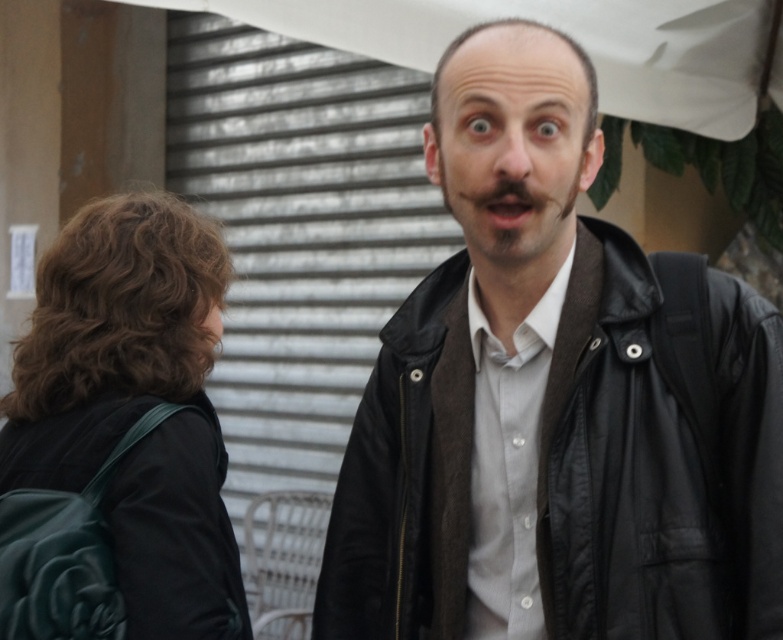
Measure the distance between dark brown hair at left and camera.

The distance of dark brown hair at left from camera is 2.20 meters.

Which of these two, dark brown hair at left or brown fuzzy beard at center, stands taller?

With more height is dark brown hair at left.

Locate an element on the screen. The image size is (783, 640). dark brown hair at left is located at coordinates (118, 308).

Is black leather jacket at center further to the viewer compared to dark brown hair at left?

No, black leather jacket at center is closer to the viewer.

Who is more distant from viewer, (511, 547) or (146, 497)?

Positioned behind is point (511, 547).

Image resolution: width=783 pixels, height=640 pixels. I want to click on black leather jacket at center, so click(x=554, y=464).

Can you confirm if black leather jacket at center is positioned below brown fuzzy beard at center?

Indeed, black leather jacket at center is positioned under brown fuzzy beard at center.

Who is positioned more to the right, black leather jacket at center or brown fuzzy beard at center?

black leather jacket at center

Does point (576, 88) come farther from viewer compared to point (471, 257)?

No.

Find the location of a particular element. The image size is (783, 640). black leather jacket at center is located at coordinates (554, 464).